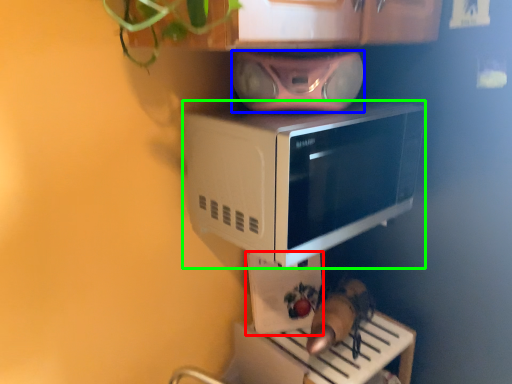
Question: Which object is the farthest from appliance (highlighted by a red box)? Choose among these: stereo (highlighted by a blue box) or microwave oven (highlighted by a green box).

Choices:
 (A) stereo
 (B) microwave oven

Answer: (B)